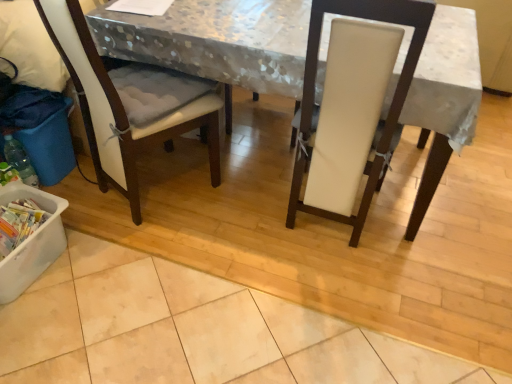
The image size is (512, 384). What do you see at coordinates (32, 242) in the screenshot? I see `white plastic container at lower left, marked as the first recycling bin in a bottom-to-top arrangement` at bounding box center [32, 242].

Where is `white fabric chair at left, the 1th chair in the left-to-right sequence`? Image resolution: width=512 pixels, height=384 pixels. white fabric chair at left, the 1th chair in the left-to-right sequence is located at coordinates (119, 107).

How much space does white leather chair at center, the second chair when ordered from left to right, occupy vertically?

1.06 meters.

Measure the distance between point (1, 2) and camera.

Point (1, 2) and camera are 5.84 feet apart from each other.

Describe the element at coordinates (30, 46) in the screenshot. Image resolution: width=512 pixels, height=384 pixels. I see `white fabric cushion at left` at that location.

The image size is (512, 384). What are the coordinates of `white plastic container at lower left, placed as the 2th recycling bin when sorted from top to bottom` in the screenshot? It's located at (32, 242).

Would you say white fabric cushion at left is outside white leather chair at center, which is the 1th chair from right to left?

Yes, white fabric cushion at left is not within white leather chair at center, which is the 1th chair from right to left.

In terms of height, does white fabric cushion at left look taller or shorter compared to white leather chair at center, which is the 1th chair from right to left?

In the image, white fabric cushion at left appears to be shorter than white leather chair at center, which is the 1th chair from right to left.

From a real-world perspective, does white fabric cushion at left stand above white leather chair at center, which is the 1th chair from right to left?

Correct, in the physical world, white fabric cushion at left is higher than white leather chair at center, which is the 1th chair from right to left.

Is white fabric cushion at left oriented towards white leather chair at center, which is the 1th chair from right to left?

Yes, white fabric cushion at left faces towards white leather chair at center, which is the 1th chair from right to left.

Is the depth of white fabric chair at left, the 1th chair in the left-to-right sequence, greater than that of white fabric-covered table at center?

No, the depth of white fabric chair at left, the 1th chair in the left-to-right sequence, is less than that of white fabric-covered table at center.

What's the angular difference between white fabric chair at left, the second chair positioned from the right, and white fabric-covered table at center's facing directions?

63.5 degrees separate the facing orientations of white fabric chair at left, the second chair positioned from the right, and white fabric-covered table at center.

From a real-world perspective, is white fabric chair at left, the 1th chair in the left-to-right sequence, above or below white fabric-covered table at center?

white fabric chair at left, the 1th chair in the left-to-right sequence, is above white fabric-covered table at center.

Consider the image. Is white fabric-covered table at center surrounded by white fabric chair at left, the 1th chair in the left-to-right sequence?

That's incorrect, white fabric-covered table at center is not inside white fabric chair at left, the 1th chair in the left-to-right sequence.

From the image's perspective, relative to white fabric chair at left, the second chair positioned from the right, is white fabric cushion at left above or below?

white fabric cushion at left is above white fabric chair at left, the second chair positioned from the right.

Based on the photo, between white fabric cushion at left and white fabric chair at left, the second chair positioned from the right, which one is positioned in front?

white fabric chair at left, the second chair positioned from the right, is more forward.

Is white fabric cushion at left at the right side of white fabric chair at left, the second chair positioned from the right?

In fact, white fabric cushion at left is to the left of white fabric chair at left, the second chair positioned from the right.

What's the angular difference between white fabric cushion at left and white fabric chair at left, the second chair positioned from the right,'s facing directions?

white fabric cushion at left and white fabric chair at left, the second chair positioned from the right, are facing 62.4 degrees away from each other.

Can you confirm if white fabric chair at left, the second chair positioned from the right, is thinner than white fabric cushion at left?

No.

Is white fabric chair at left, the 1th chair in the left-to-right sequence, placed right next to white fabric cushion at left?

white fabric chair at left, the 1th chair in the left-to-right sequence, is not next to white fabric cushion at left, and they're not touching.

Between white fabric chair at left, the second chair positioned from the right, and white fabric cushion at left, which one appears on the left side from the viewer's perspective?

Positioned to the left is white fabric cushion at left.

How many degrees apart are the facing directions of white fabric chair at left, the 1th chair in the left-to-right sequence, and translucent plastic bottle at lower left?

They differ by 65.6 degrees in their facing directions.

This screenshot has height=384, width=512. Identify the location of the 1st chair in front of the translucent plastic bottle at lower left, counting from the anchor's position. (119, 107).

Between point (104, 69) and point (4, 145), which one is positioned in front?

Positioned in front is point (104, 69).

Between white fabric chair at left, the 1th chair in the left-to-right sequence, and blue plastic recycling bin at lower left, which ranks as the second recycling bin in bottom-to-top order, which one has smaller size?

With smaller size is blue plastic recycling bin at lower left, which ranks as the second recycling bin in bottom-to-top order.

Are white fabric chair at left, the 1th chair in the left-to-right sequence, and blue plastic recycling bin at lower left, which ranks as the second recycling bin in bottom-to-top order, located far from each other?

No, there isn't a large distance between white fabric chair at left, the 1th chair in the left-to-right sequence, and blue plastic recycling bin at lower left, which ranks as the second recycling bin in bottom-to-top order.

From the picture: Is white fabric chair at left, the 1th chair in the left-to-right sequence, aimed at blue plastic recycling bin at lower left, acting as the first recycling bin starting from the top?

No, white fabric chair at left, the 1th chair in the left-to-right sequence, does not turn towards blue plastic recycling bin at lower left, acting as the first recycling bin starting from the top.

From a real-world perspective, is white fabric chair at left, the second chair positioned from the right, positioned above or below blue plastic recycling bin at lower left, acting as the first recycling bin starting from the top?

white fabric chair at left, the second chair positioned from the right, is above blue plastic recycling bin at lower left, acting as the first recycling bin starting from the top.

Is blue plastic recycling bin at lower left, which ranks as the second recycling bin in bottom-to-top order, bigger or smaller than white fabric-covered table at center?

blue plastic recycling bin at lower left, which ranks as the second recycling bin in bottom-to-top order, is smaller than white fabric-covered table at center.

Is blue plastic recycling bin at lower left, acting as the first recycling bin starting from the top, aimed at white fabric-covered table at center?

No, blue plastic recycling bin at lower left, acting as the first recycling bin starting from the top, is not facing towards white fabric-covered table at center.

Can you confirm if blue plastic recycling bin at lower left, which ranks as the second recycling bin in bottom-to-top order, is thinner than white fabric-covered table at center?

Correct, the width of blue plastic recycling bin at lower left, which ranks as the second recycling bin in bottom-to-top order, is less than that of white fabric-covered table at center.

Consider the image. Is blue plastic recycling bin at lower left, which ranks as the second recycling bin in bottom-to-top order, in front of or behind white fabric-covered table at center in the image?

Visually, blue plastic recycling bin at lower left, which ranks as the second recycling bin in bottom-to-top order, is located behind white fabric-covered table at center.

Identify the location of leftover that is above the white leather chair at center, which is the 1th chair from right to left (from a real-world perspective). Image resolution: width=512 pixels, height=384 pixels. (30, 46).

Where is `table located underneath the white fabric chair at left, the second chair positioned from the right (from a real-world perspective)`? This screenshot has width=512, height=384. table located underneath the white fabric chair at left, the second chair positioned from the right (from a real-world perspective) is located at coordinates (216, 41).

Based on their spatial positions, is white plastic container at lower left, placed as the 2th recycling bin when sorted from top to bottom, or white fabric-covered table at center further from white fabric chair at left, the second chair positioned from the right?

white plastic container at lower left, placed as the 2th recycling bin when sorted from top to bottom, is positioned further to the anchor white fabric chair at left, the second chair positioned from the right.

Considering their positions, is white fabric chair at left, the second chair positioned from the right, positioned further to blue plastic recycling bin at lower left, acting as the first recycling bin starting from the top, than white fabric cushion at left?

white fabric chair at left, the second chair positioned from the right, is further to blue plastic recycling bin at lower left, acting as the first recycling bin starting from the top.

Looking at the image, which one is located closer to white fabric-covered table at center, blue plastic recycling bin at lower left, which ranks as the second recycling bin in bottom-to-top order, or white fabric chair at left, the second chair positioned from the right?

Based on the image, white fabric chair at left, the second chair positioned from the right, appears to be nearer to white fabric-covered table at center.

Based on their spatial positions, is white fabric chair at left, the second chair positioned from the right, or translucent plastic bottle at lower left further from blue plastic recycling bin at lower left, acting as the first recycling bin starting from the top?

Based on the image, white fabric chair at left, the second chair positioned from the right, appears to be further to blue plastic recycling bin at lower left, acting as the first recycling bin starting from the top.

Which object lies nearer to the anchor point white plastic container at lower left, marked as the first recycling bin in a bottom-to-top arrangement, white fabric cushion at left or white fabric chair at left, the 1th chair in the left-to-right sequence?

white fabric chair at left, the 1th chair in the left-to-right sequence, is positioned closer to the anchor white plastic container at lower left, marked as the first recycling bin in a bottom-to-top arrangement.

In the scene shown: When comparing their distances from white fabric chair at left, the second chair positioned from the right, does white fabric-covered table at center or blue plastic recycling bin at lower left, which ranks as the second recycling bin in bottom-to-top order, seem closer?

Based on the image, white fabric-covered table at center appears to be nearer to white fabric chair at left, the second chair positioned from the right.

Based on their spatial positions, is translucent plastic bottle at lower left or white fabric chair at left, the second chair positioned from the right, closer to white leather chair at center, the second chair when ordered from left to right?

The object closer to white leather chair at center, the second chair when ordered from left to right, is white fabric chair at left, the second chair positioned from the right.

Based on their spatial positions, is white fabric-covered table at center or white leather chair at center, which is the 1th chair from right to left, further from white fabric chair at left, the second chair positioned from the right?

Based on the image, white leather chair at center, which is the 1th chair from right to left, appears to be further to white fabric chair at left, the second chair positioned from the right.

Image resolution: width=512 pixels, height=384 pixels. What are the coordinates of `bottle that lies between blue plastic recycling bin at lower left, which ranks as the second recycling bin in bottom-to-top order, and white plastic container at lower left, placed as the 2th recycling bin when sorted from top to bottom, from top to bottom` in the screenshot? It's located at (20, 160).

The width and height of the screenshot is (512, 384). I want to click on table situated between blue plastic recycling bin at lower left, acting as the first recycling bin starting from the top, and white leather chair at center, which is the 1th chair from right to left, from left to right, so click(x=216, y=41).

Locate an element on the screen. leftover between blue plastic recycling bin at lower left, acting as the first recycling bin starting from the top, and white fabric chair at left, the second chair positioned from the right, in the horizontal direction is located at coordinates (30, 46).

This screenshot has height=384, width=512. Identify the location of table between white fabric chair at left, the 1th chair in the left-to-right sequence, and white leather chair at center, the second chair when ordered from left to right, from left to right. (216, 41).